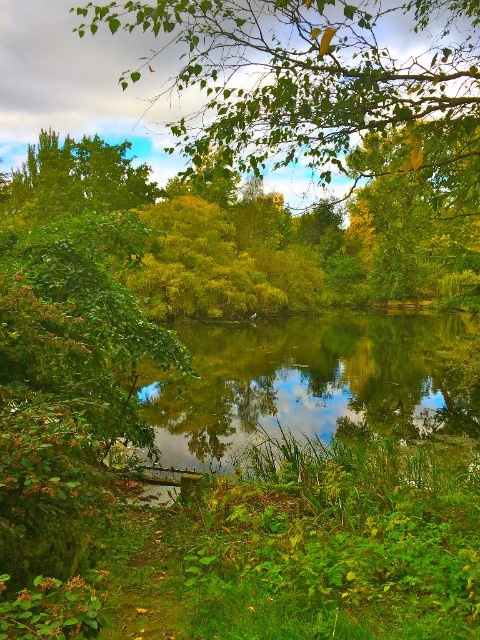
Question: Can you confirm if green leafy tree at upper center is positioned to the right of green reflective water at center?

Choices:
 (A) no
 (B) yes

Answer: (A)

Question: Is green leafy tree at upper center smaller than green reflective water at center?

Choices:
 (A) no
 (B) yes

Answer: (A)

Question: Which point is closer to the camera?

Choices:
 (A) (238, 122)
 (B) (356, 410)

Answer: (A)

Question: Is green leafy tree at upper center smaller than green reflective water at center?

Choices:
 (A) no
 (B) yes

Answer: (A)